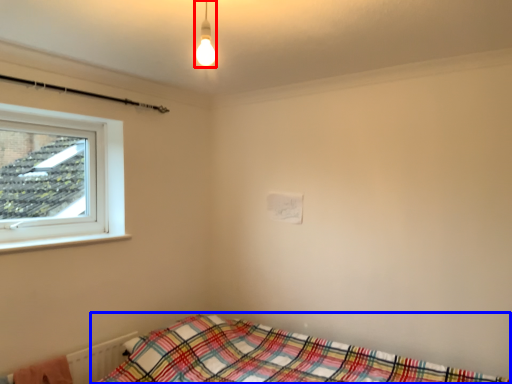
Question: Among these objects, which one is farthest to the camera, light fixture (highlighted by a red box) or bed (highlighted by a blue box)?

Choices:
 (A) light fixture
 (B) bed

Answer: (A)